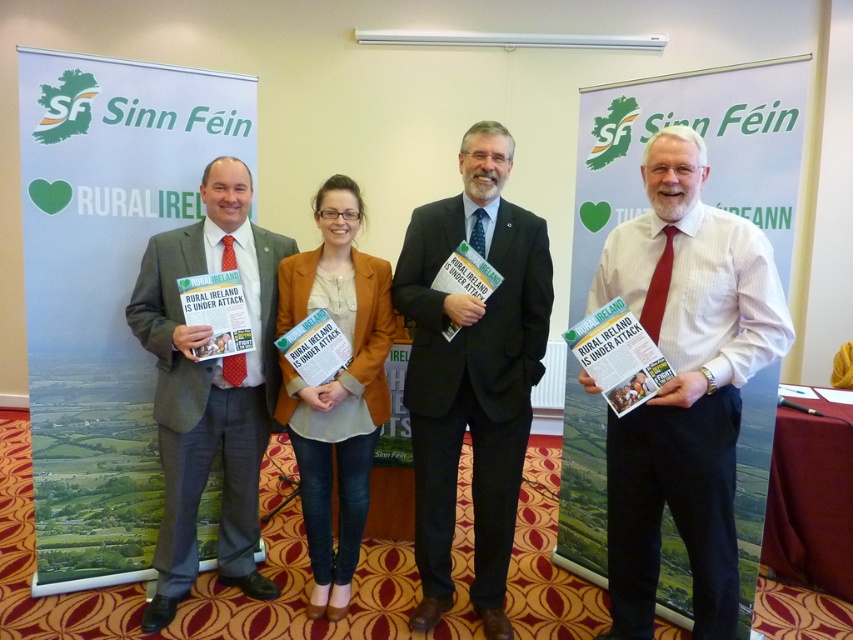
Which is more to the left, white striped shirt at center or matte gray suit at center?

matte gray suit at center is more to the left.

Is point (788, 339) positioned behind point (132, 317)?

No, (788, 339) is closer to viewer.

The width and height of the screenshot is (853, 640). Find the location of `white striped shirt at center`. white striped shirt at center is located at coordinates (683, 385).

Between point (674, 269) and point (376, 410), which one is positioned behind?

Point (376, 410)

Where is `white striped shirt at center`? The image size is (853, 640). white striped shirt at center is located at coordinates (683, 385).

The image size is (853, 640). I want to click on white striped shirt at center, so click(683, 385).

Which is below, white striped shirt at center or dark blue suit at center?

white striped shirt at center is lower down.

Describe the element at coordinates (683, 385) in the screenshot. I see `white striped shirt at center` at that location.

Find the location of `white striped shirt at center`. white striped shirt at center is located at coordinates (683, 385).